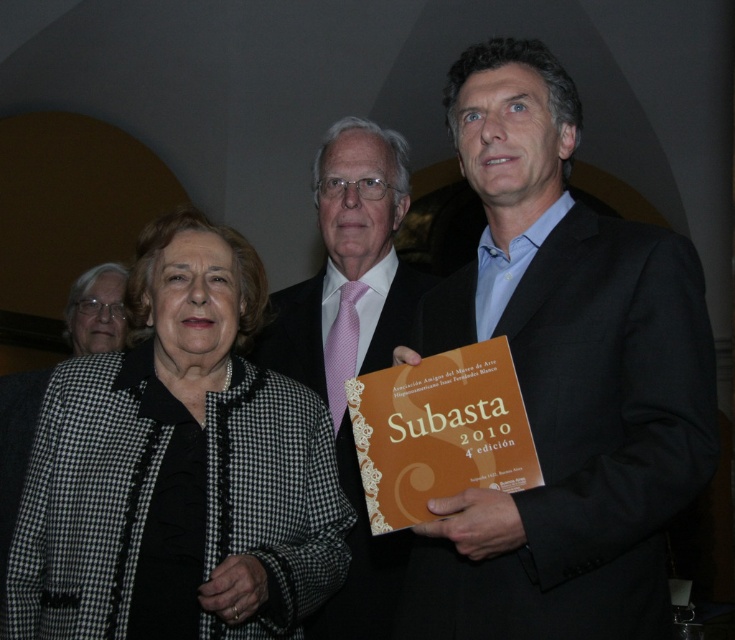
Image resolution: width=735 pixels, height=640 pixels. Describe the element at coordinates (562, 380) in the screenshot. I see `black suit at right` at that location.

Can you confirm if black suit at right is bigger than black checkered jacket at center?

Correct, black suit at right is larger in size than black checkered jacket at center.

Which is behind, point (537, 200) or point (114, 449)?

Positioned behind is point (537, 200).

Locate an element on the screen. The image size is (735, 640). black suit at right is located at coordinates (562, 380).

Is black suit at right above orange matte book at center?

Correct, black suit at right is located above orange matte book at center.

Between black suit at right and orange matte book at center, which one appears on the right side from the viewer's perspective?

black suit at right is more to the right.

Does point (634, 557) come behind point (462, 449)?

No.

Where is `black suit at right`? This screenshot has height=640, width=735. black suit at right is located at coordinates (562, 380).

Describe the element at coordinates (179, 467) in the screenshot. I see `black checkered jacket at center` at that location.

Is point (268, 493) in front of point (405, 435)?

That is False.

Is point (32, 576) positioned in front of point (397, 408)?

That is True.

Locate an element on the screen. This screenshot has height=640, width=735. black checkered jacket at center is located at coordinates (179, 467).